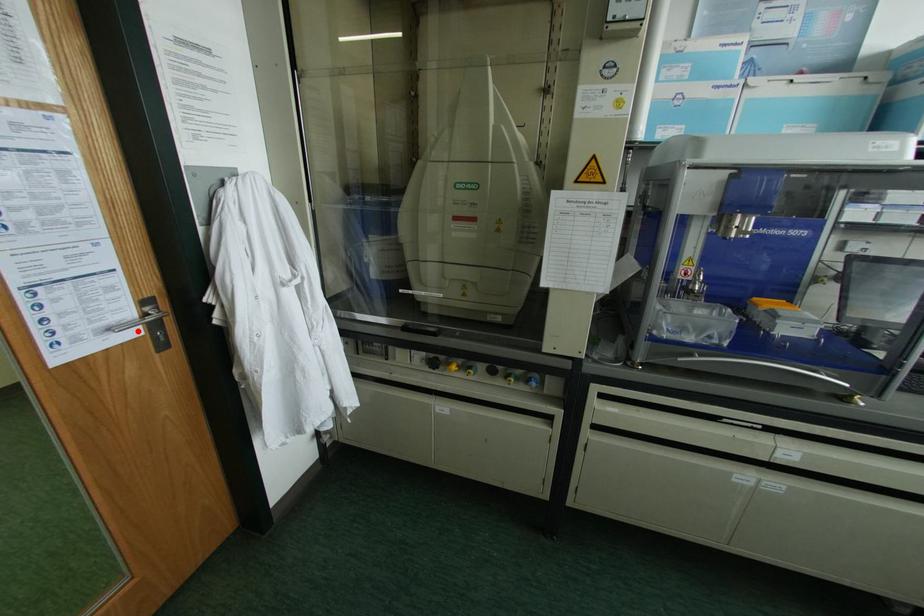
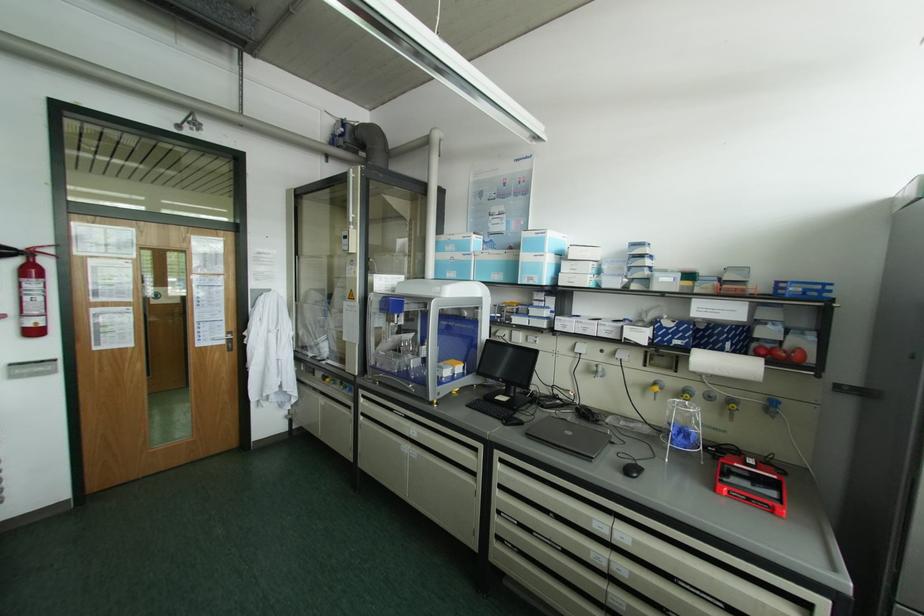
The point at the highlighted location is marked in the first image. Where is the corresponding point in the second image?

(224, 342)